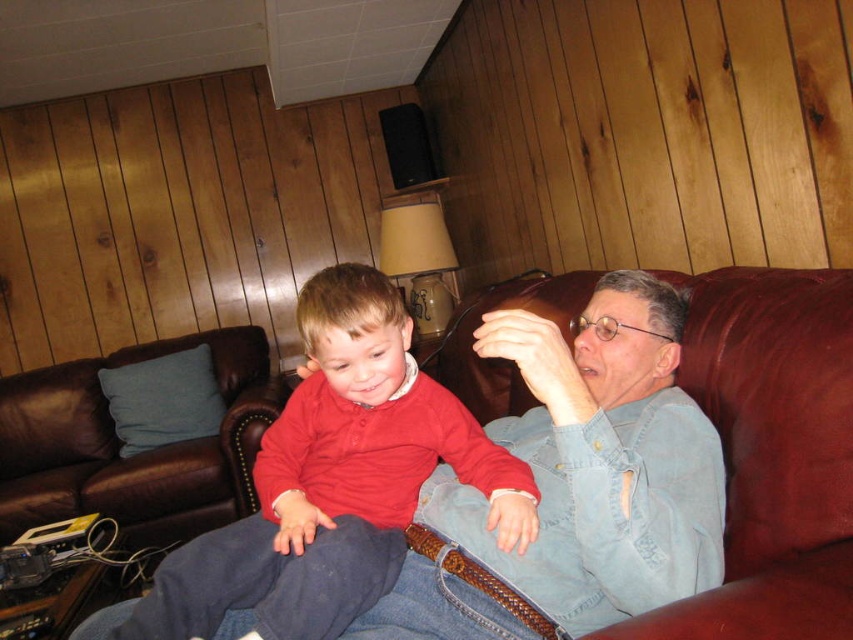
Question: Is red matte shirt at center behind matte red sweater at center?

Choices:
 (A) no
 (B) yes

Answer: (A)

Question: Is red matte shirt at center smaller than matte red sweater at center?

Choices:
 (A) yes
 (B) no

Answer: (A)

Question: Which of the following is the closest to the observer?

Choices:
 (A) (132, 502)
 (B) (213, 609)

Answer: (B)

Question: Does red matte shirt at center appear under matte red sweater at center?

Choices:
 (A) no
 (B) yes

Answer: (A)

Question: Which point is farther to the camera?

Choices:
 (A) matte red sweater at center
 (B) red matte shirt at center

Answer: (A)